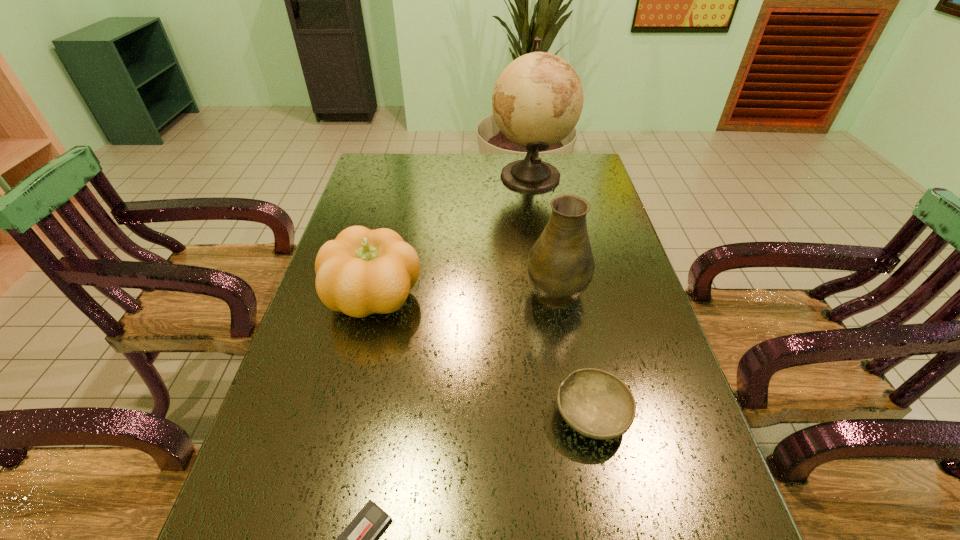
Image resolution: width=960 pixels, height=540 pixels. I want to click on vacant area at the far edge of the desktop, so click(x=477, y=173).

Identify the location of vacant space at the left edge of the desktop. pyautogui.click(x=368, y=192).

Identify the location of vacant space at the right edge. (601, 359).

Locate an element on the screen. vacant space at the far left corner is located at coordinates (360, 180).

Image resolution: width=960 pixels, height=540 pixels. Identify the location of vacant area at the far right corner of the desktop. coord(590,181).

Where is `free space between the second tallest object and the third tallest object`? This screenshot has height=540, width=960. free space between the second tallest object and the third tallest object is located at coordinates 465,293.

You are a GUI agent. You are given a task and a screenshot of the screen. Output one action in this format:
    pyautogui.click(x=<x>, y=<y>)
    Task: Click on the empty space between the tallest object and the third tallest object
    The image size is (960, 540).
    Given the screenshot: What is the action you would take?
    pyautogui.click(x=452, y=236)

Where is `blank region between the globe and the third tallest object`? The width and height of the screenshot is (960, 540). blank region between the globe and the third tallest object is located at coordinates 452,236.

What are the coordinates of `object that is the fourth closest one to the shortest object` in the screenshot? It's located at (537, 100).

Identify which object is located as the second nearest to the second nearest object. Please provide its 2D coordinates. Your answer should be formatted as a tuple, i.e. [(x, y)], where the tuple contains the x and y coordinates of a point satisfying the conditions above.

[(358, 539)]